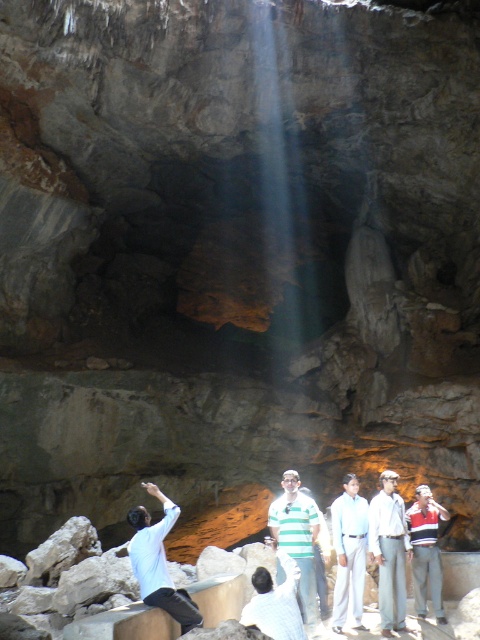
Measure the distance between white cotton shirt at center and white shirt at center.

white cotton shirt at center and white shirt at center are 4.00 feet apart from each other.

Is white cotton shirt at center behind white shirt at center?

Yes, white cotton shirt at center is further from the viewer.

What do you see at coordinates (388, 552) in the screenshot?
I see `white cotton shirt at center` at bounding box center [388, 552].

You are a GUI agent. You are given a task and a screenshot of the screen. Output one action in this format:
    pyautogui.click(x=<x>, y=<y>)
    Task: Click on the white cotton shirt at center
    
    Given the screenshot: What is the action you would take?
    pyautogui.click(x=388, y=552)

Is the position of striped cotton shirt at center more distant than that of white shirt at center?

Yes, striped cotton shirt at center is further from the viewer.

Does striped cotton shirt at center have a lesser height compared to white shirt at center?

No.

Measure the distance between point (411, 561) and camera.

Point (411, 561) is 8.95 meters away from camera.

This screenshot has height=640, width=480. In order to click on striped cotton shirt at center in this screenshot , I will do `click(425, 550)`.

Consider the image. How distant is light blue shirt at center from striped cotton shirt at center?

light blue shirt at center is 22.23 inches from striped cotton shirt at center.

Can you confirm if light blue shirt at center is positioned below striped cotton shirt at center?

Actually, light blue shirt at center is above striped cotton shirt at center.

Which is behind, point (337, 548) or point (407, 522)?

The point (407, 522) is behind.

Locate an element on the screen. This screenshot has height=640, width=480. light blue shirt at center is located at coordinates (348, 552).